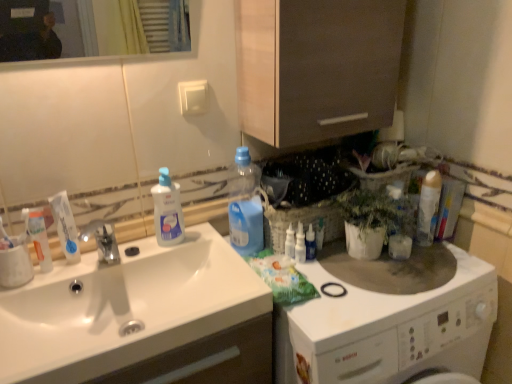
Find the location of a particular element. The height and width of the screenshot is (384, 512). free location to the right of translucent plastic spray bottle at upper right, arranged as the 2th toiletry when viewed from the front is located at coordinates (355, 268).